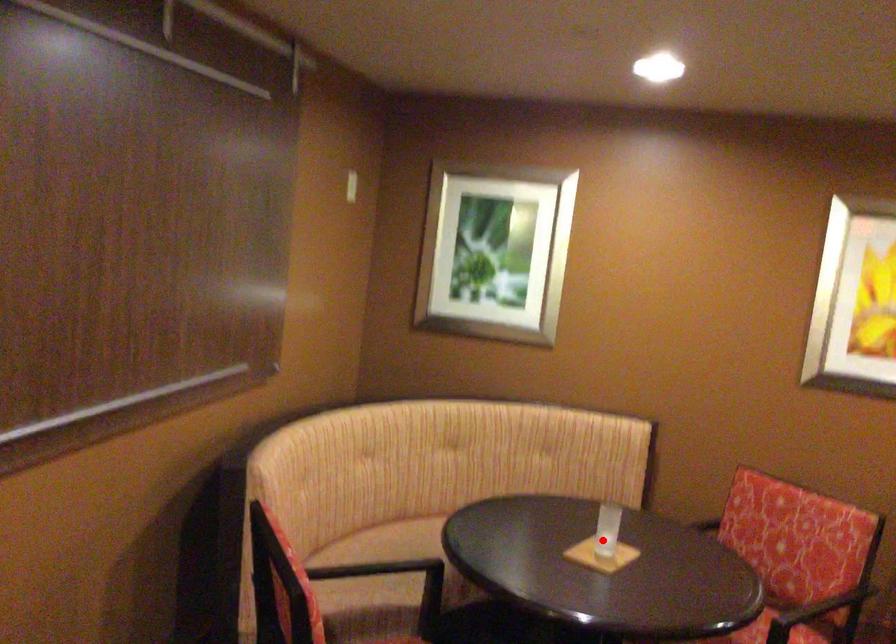
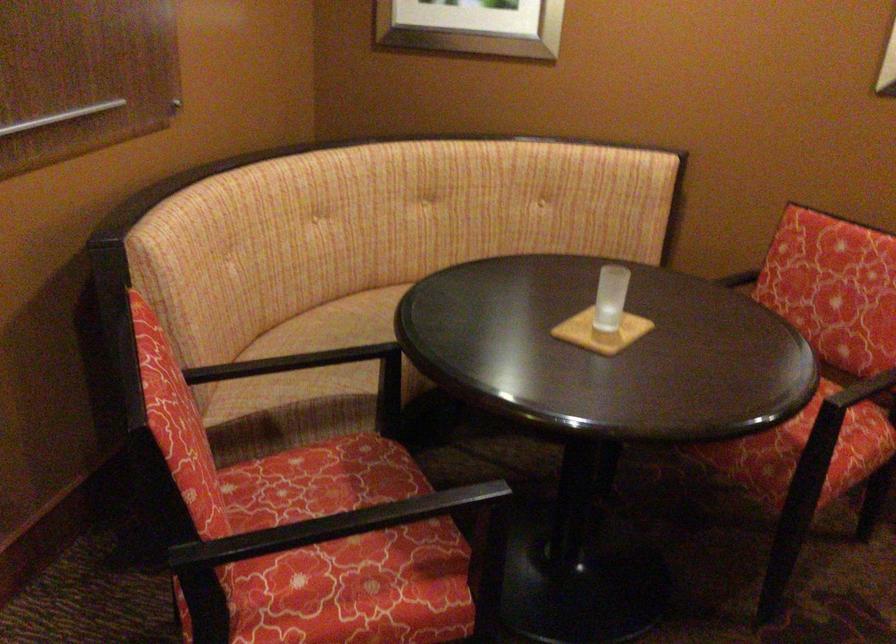
In the second image, find the point that corresponds to the highlighted location in the first image.

(609, 297)